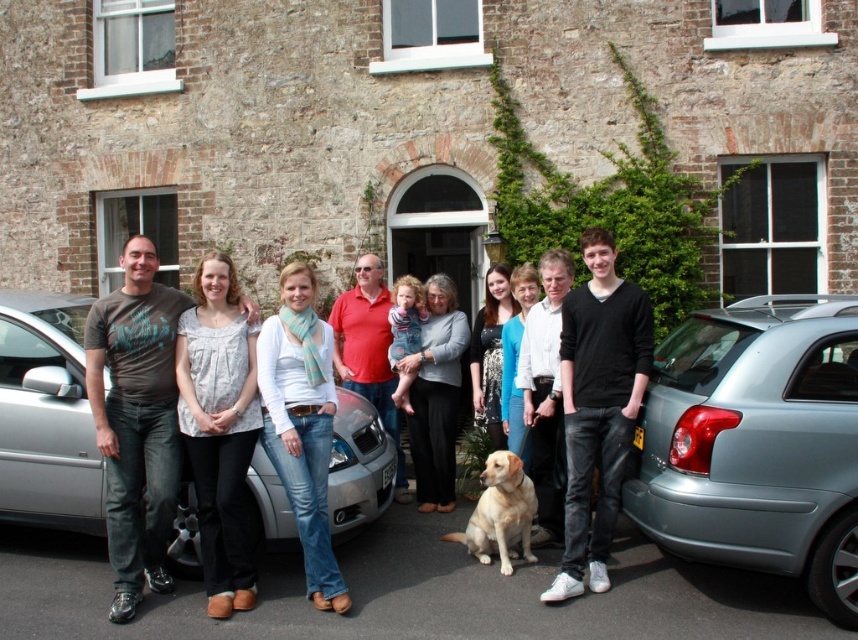
In the scene shown: You are a photographer setting up for a group photo. You notice a metallic gray hatchback at lower right and a silver metallic car at center. Which car is positioned to the right of the other?

The metallic gray hatchback at lower right is positioned to the right of the silver metallic car at center.

You are standing in front of the brick building and want to park your car, which is a metallic gray hatchback at lower right. The parking spot is located at point (757, 444). Can you safely park your car there?

Yes, the point (757, 444) marks the location of the metallic gray hatchback at lower right, so you can safely park there.